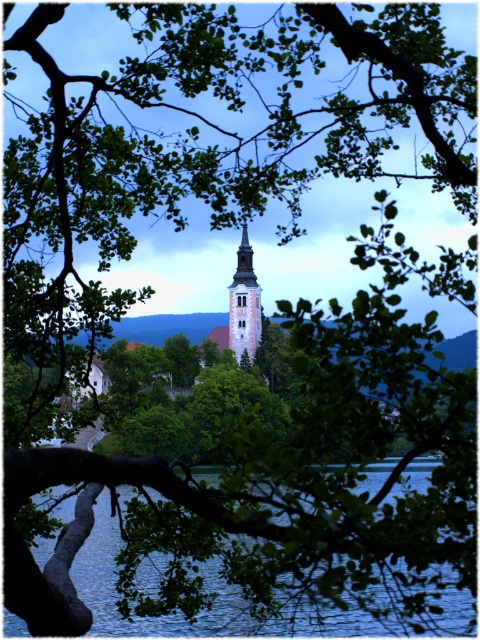
Question: Does blue water at lower center have a greater width compared to smooth glass spire at center?

Choices:
 (A) yes
 (B) no

Answer: (A)

Question: Among these points, which one is farthest from the camera?

Choices:
 (A) (163, 616)
 (B) (231, 291)

Answer: (B)

Question: Among these points, which one is nearest to the camera?

Choices:
 (A) (101, 605)
 (B) (237, 262)

Answer: (A)

Question: Observing the image, what is the correct spatial positioning of blue water at lower center in reference to smooth glass spire at center?

Choices:
 (A) left
 (B) right

Answer: (B)

Question: Which point is closer to the camera?

Choices:
 (A) (375, 589)
 (B) (245, 314)

Answer: (A)

Question: Is blue water at lower center thinner than smooth glass spire at center?

Choices:
 (A) yes
 (B) no

Answer: (B)